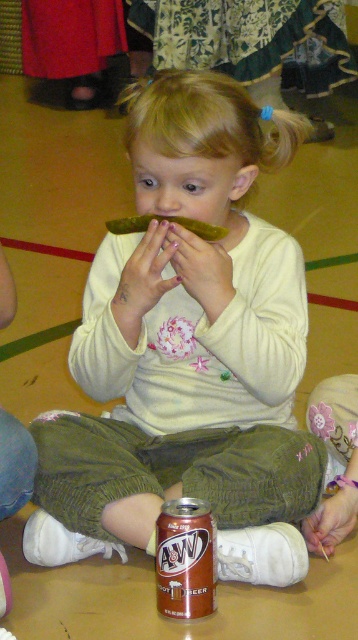
Question: Where is brown matte can at center located in relation to smooth skin hand at lower right in the image?

Choices:
 (A) above
 (B) below

Answer: (B)

Question: Is brown matte can at center above matte yellow banana at center?

Choices:
 (A) no
 (B) yes

Answer: (A)

Question: Which object is the farthest from the green pickled cucumber at center?

Choices:
 (A) matte yellow banana at center
 (B) smooth skin hand at lower right
 (C) pale skin at center
 (D) brown matte can at center

Answer: (B)

Question: Which point is closer to the camera taking this photo?

Choices:
 (A) pyautogui.click(x=147, y=301)
 (B) pyautogui.click(x=351, y=497)
 (C) pyautogui.click(x=218, y=278)

Answer: (C)

Question: Can you confirm if brown matte can at center is wider than green pickled cucumber at center?

Choices:
 (A) no
 (B) yes

Answer: (A)

Question: Which point is farther to the camera?

Choices:
 (A) matte yellow banana at center
 (B) smooth skin hand at lower right

Answer: (B)